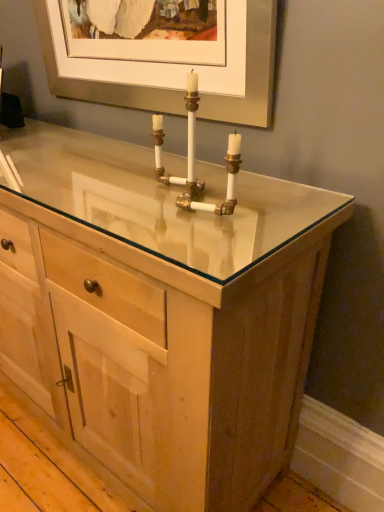
Question: Based on their positions, is natural wood cabinet at center located to the left or right of white brass pipe at center?

Choices:
 (A) left
 (B) right

Answer: (A)

Question: In terms of height, does natural wood cabinet at center look taller or shorter compared to white brass pipe at center?

Choices:
 (A) tall
 (B) short

Answer: (A)

Question: Is natural wood cabinet at center wider or thinner than white brass pipe at center?

Choices:
 (A) wide
 (B) thin

Answer: (A)

Question: Is white brass pipe at center in front of or behind natural wood cabinet at center in the image?

Choices:
 (A) behind
 (B) front

Answer: (A)

Question: From the image's perspective, is white brass pipe at center positioned above or below natural wood cabinet at center?

Choices:
 (A) below
 (B) above

Answer: (B)

Question: Is point (231, 145) positioned closer to the camera than point (322, 193)?

Choices:
 (A) farther
 (B) closer

Answer: (B)

Question: Do you think white brass pipe at center is within natural wood cabinet at center, or outside of it?

Choices:
 (A) outside
 (B) inside

Answer: (A)